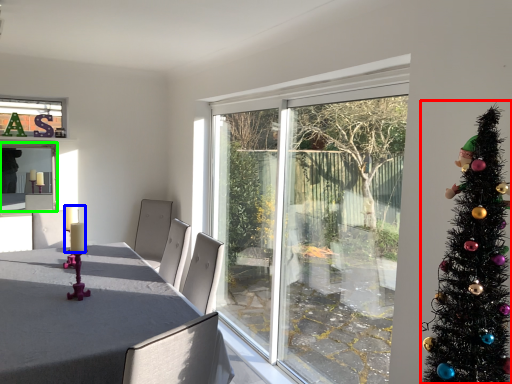
Question: Which object is positioned farthest from christmas tree (highlighted by a red box)? Select from candle (highlighted by a blue box) and window screen (highlighted by a green box).

Choices:
 (A) candle
 (B) window screen

Answer: (B)